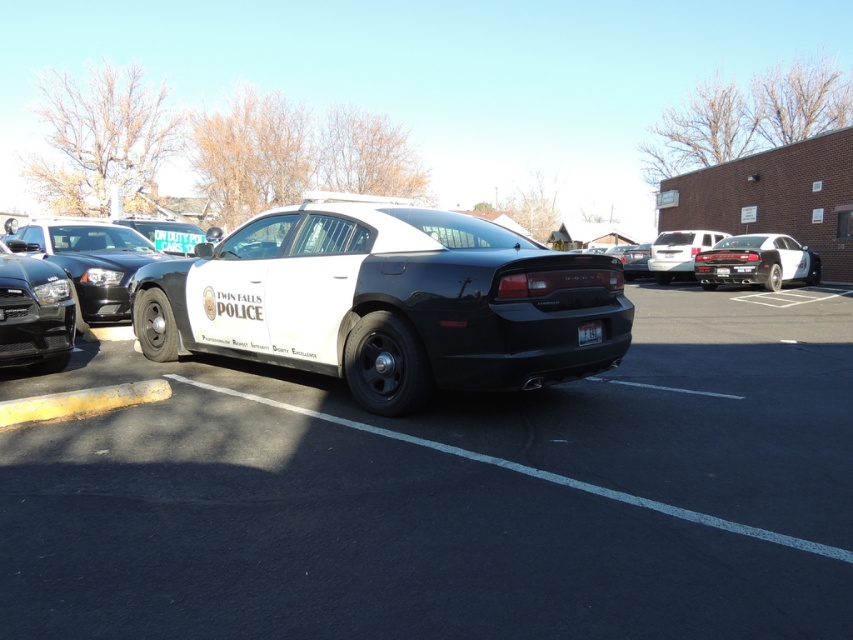
You are a parking attendant who needs to fit a compact car into the parking space between the black matte police car at center and the white matte suv at center. Based on their sizes, will the compact car fit in the space between them?

The black matte police car at center occupies less space than the white matte suv at center, so the compact car may fit depending on the exact dimensions of the space between them.

Based on the photo, you are a parking attendant who needs to fit a compact car into the remaining space between the black matte police car at center and the white glossy sedan at right. Based on their sizes, which vehicle should you position closer to the compact car to ensure it fits?

The black matte police car at center is smaller than the white glossy sedan at right, so positioning the compact car closer to the black matte police car at center would provide enough space for it to fit.